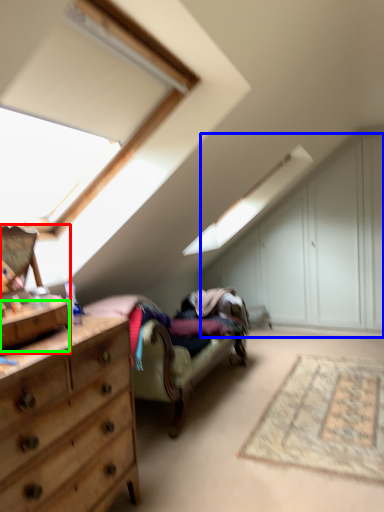
Question: Which is farther away from cabinetry (highlighted by a red box)? dresser (highlighted by a blue box) or drawer (highlighted by a green box)?

Choices:
 (A) dresser
 (B) drawer

Answer: (A)